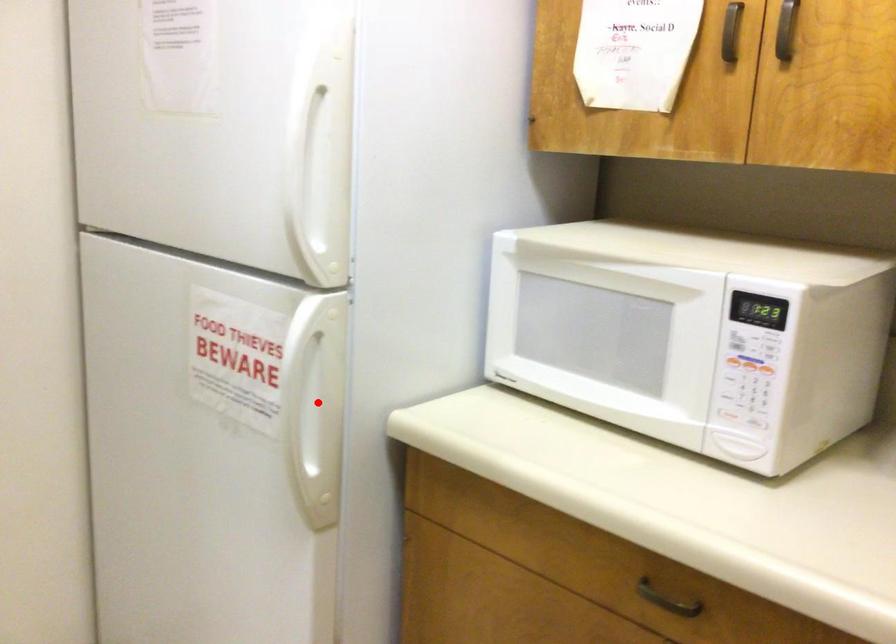
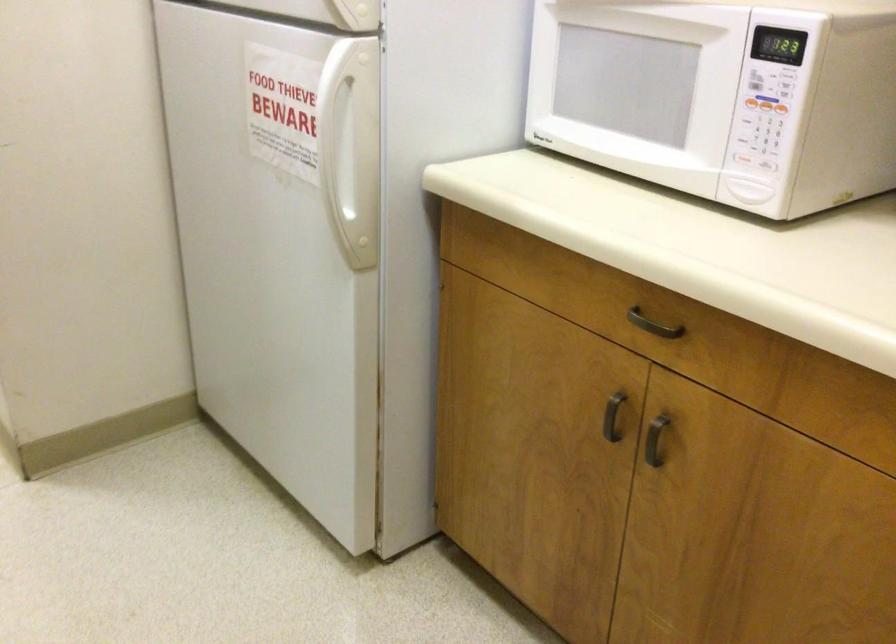
In the second image, find the point that corresponds to the highlighted location in the first image.

(350, 146)